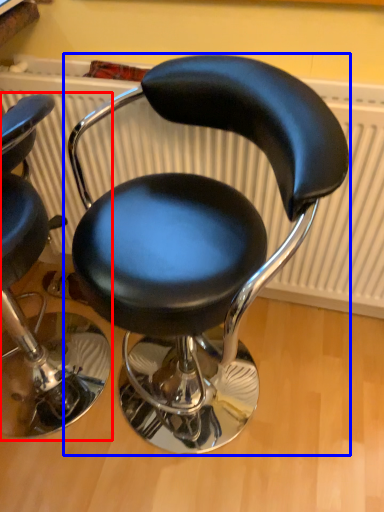
Question: Which point is further to the camera, chair (highlighted by a red box) or chair (highlighted by a blue box)?

Choices:
 (A) chair
 (B) chair

Answer: (A)